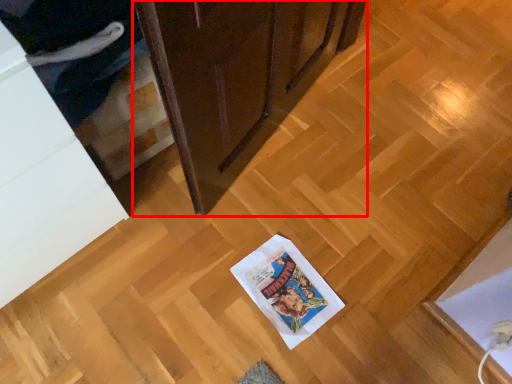
Question: In this image, where is cabinetry (annotated by the red box) located relative to cabinetry?

Choices:
 (A) right
 (B) left

Answer: (A)